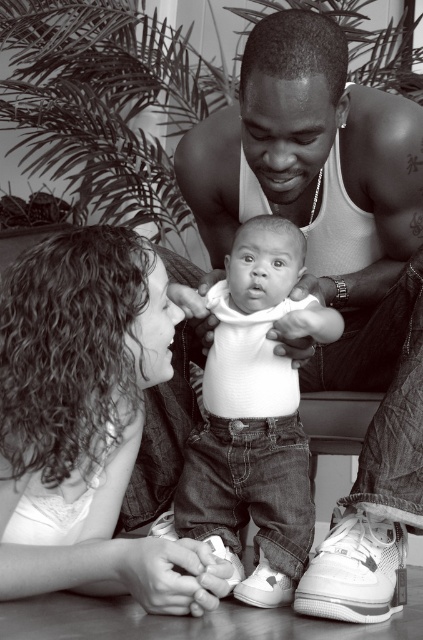
Can you confirm if curly hair at center is bigger than white soft fabric baby at center?

Yes.

I want to click on curly hair at center, so click(x=87, y=422).